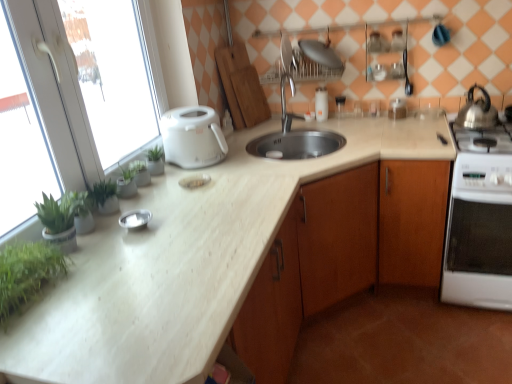
Locate an element on the screen. The width and height of the screenshot is (512, 384). empty space that is to the right of white plastic toaster at left, the second kitchen appliance in the right-to-left sequence is located at coordinates (262, 152).